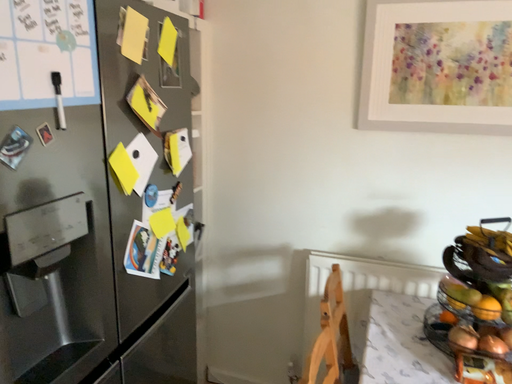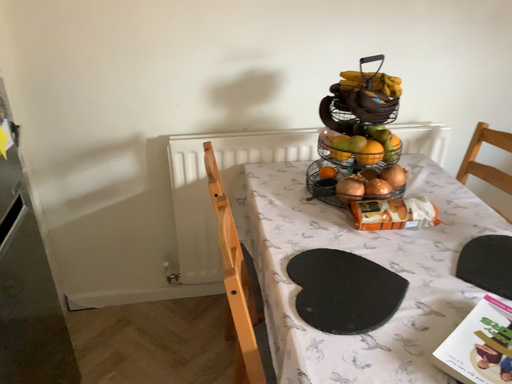
Question: Which way did the camera rotate in the video?

Choices:
 (A) rotated downward
 (B) rotated upward

Answer: (A)